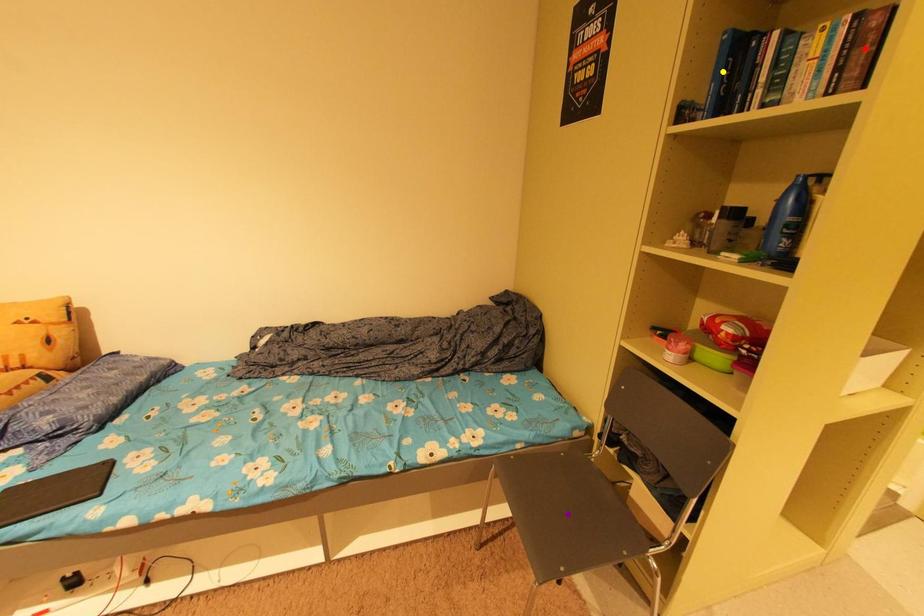
Order these from farthest to nearest:
1. purple point
2. yellow point
3. red point

purple point < yellow point < red point